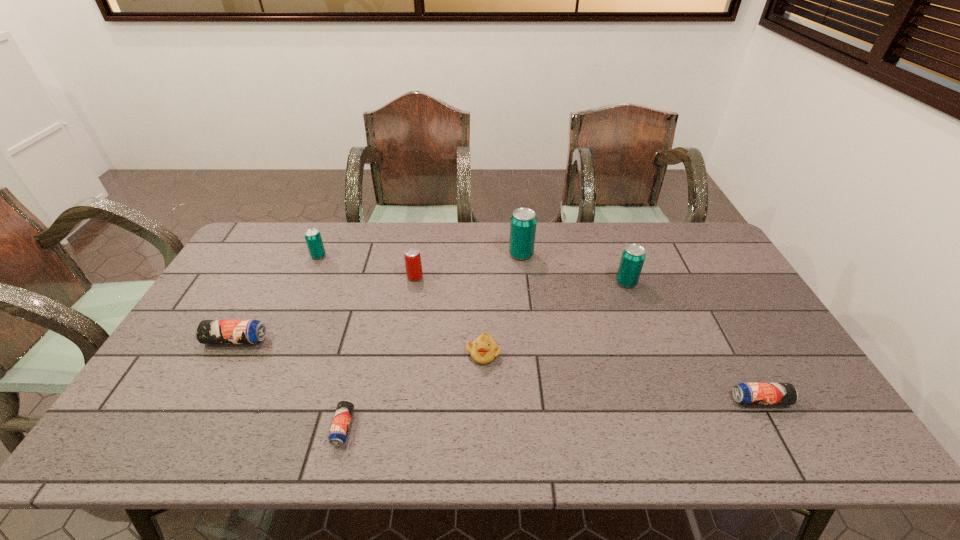
This screenshot has width=960, height=540. I want to click on vacant area that lies between the smallest blue beer can and the sixth tallest beer can, so click(x=552, y=414).

Find the location of a particular element. The height and width of the screenshot is (540, 960). vacant area between the yellow duckling and the biggest teal beer can is located at coordinates (502, 303).

Where is `object that can be found as the seventh closest to the pink beer can`? This screenshot has height=540, width=960. object that can be found as the seventh closest to the pink beer can is located at coordinates (745, 393).

Where is `the sixth closest object to the fifth object from left to right`? This screenshot has height=540, width=960. the sixth closest object to the fifth object from left to right is located at coordinates (745, 393).

Locate which beer can is the fourth closest to the biggest teal beer can. Please provide its 2D coordinates. Your answer should be formatted as a tuple, i.e. [(x, y)], where the tuple contains the x and y coordinates of a point satisfying the conditions above.

[(745, 393)]

Select which beer can appears as the second closest to the third nearest beer can. Please provide its 2D coordinates. Your answer should be formatted as a tuple, i.e. [(x, y)], where the tuple contains the x and y coordinates of a point satisfying the conditions above.

[(313, 238)]

Locate which teal beer can ranks second in proximity to the rightmost blue beer can. Please provide its 2D coordinates. Your answer should be formatted as a tuple, i.e. [(x, y)], where the tuple contains the x and y coordinates of a point satisfying the conditions above.

[(523, 223)]

Identify the location of teal beer can that stands as the second closest to the sixth tallest beer can. The width and height of the screenshot is (960, 540). (523, 223).

Find the location of `the second closest blue beer can to the tallest beer can`. the second closest blue beer can to the tallest beer can is located at coordinates (339, 429).

Identify which blue beer can is the second closest to the leftmost teal beer can. Please provide its 2D coordinates. Your answer should be formatted as a tuple, i.e. [(x, y)], where the tuple contains the x and y coordinates of a point satisfying the conditions above.

[(339, 429)]